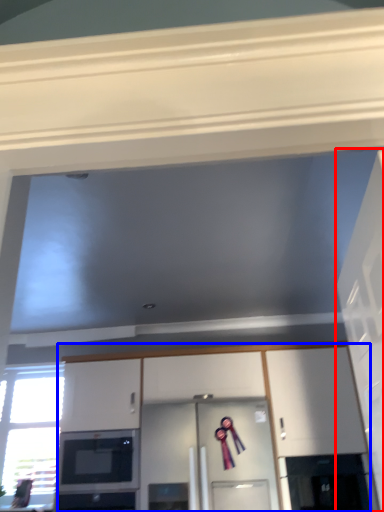
Question: Among these objects, which one is nearest to the camera, door (highlighted by a red box) or cabinetry (highlighted by a blue box)?

Choices:
 (A) door
 (B) cabinetry

Answer: (A)